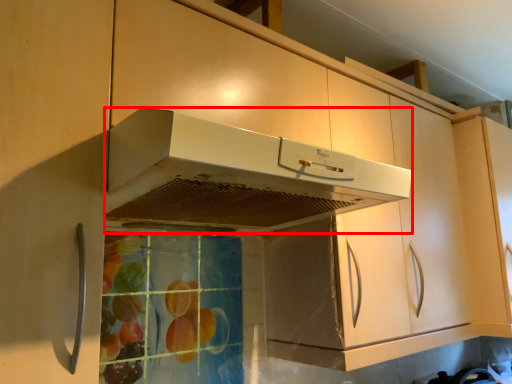
Question: From the image's perspective, where is home appliance (annotated by the red box) located relative to cabinetry?

Choices:
 (A) below
 (B) above

Answer: (B)